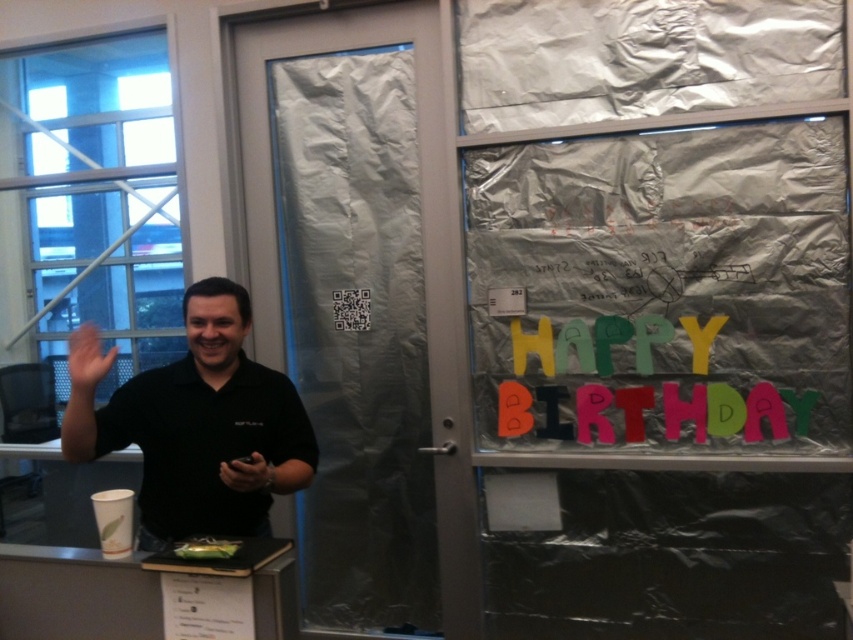
Can you confirm if silver/metallic foil at upper right is positioned above matte black phone at center?

Indeed, silver/metallic foil at upper right is positioned over matte black phone at center.

Is silver/metallic foil at upper right further to camera compared to matte black phone at center?

Yes, it is.

This screenshot has height=640, width=853. Find the location of `silver/metallic foil at upper right`. silver/metallic foil at upper right is located at coordinates (640, 58).

Does black matte shirt at center appear under green matte cake at center?

Incorrect, black matte shirt at center is not positioned below green matte cake at center.

Where is `black matte shirt at center`? The height and width of the screenshot is (640, 853). black matte shirt at center is located at coordinates (201, 426).

The width and height of the screenshot is (853, 640). Identify the location of black matte shirt at center. tap(201, 426).

Is translucent skin at center shorter than matte black phone at center?

No.

Does translucent skin at center come behind matte black phone at center?

That is True.

Locate an element on the screen. Image resolution: width=853 pixels, height=640 pixels. translucent skin at center is located at coordinates (86, 358).